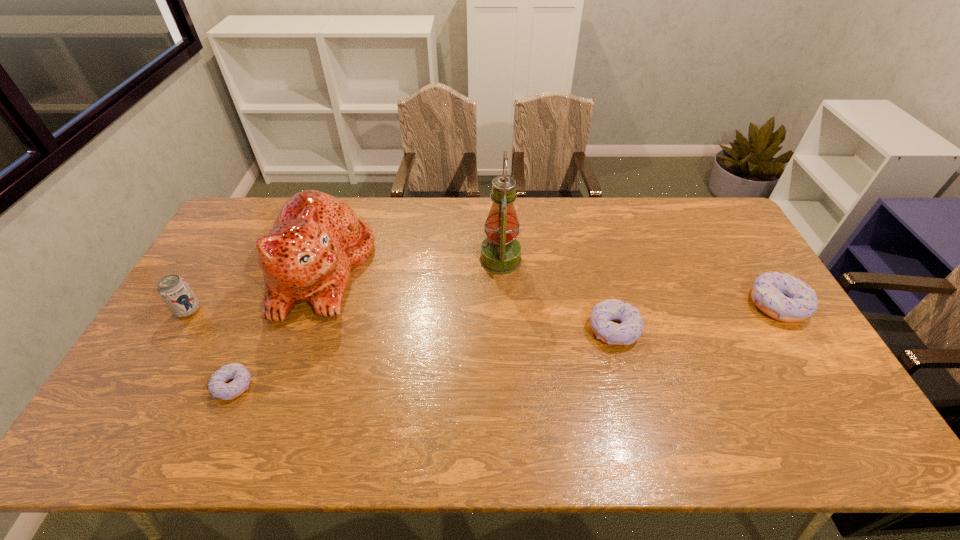
This screenshot has height=540, width=960. Find the location of `vacant spot for a new doughnut to ensure equal spacing`. vacant spot for a new doughnut to ensure equal spacing is located at coordinates (434, 356).